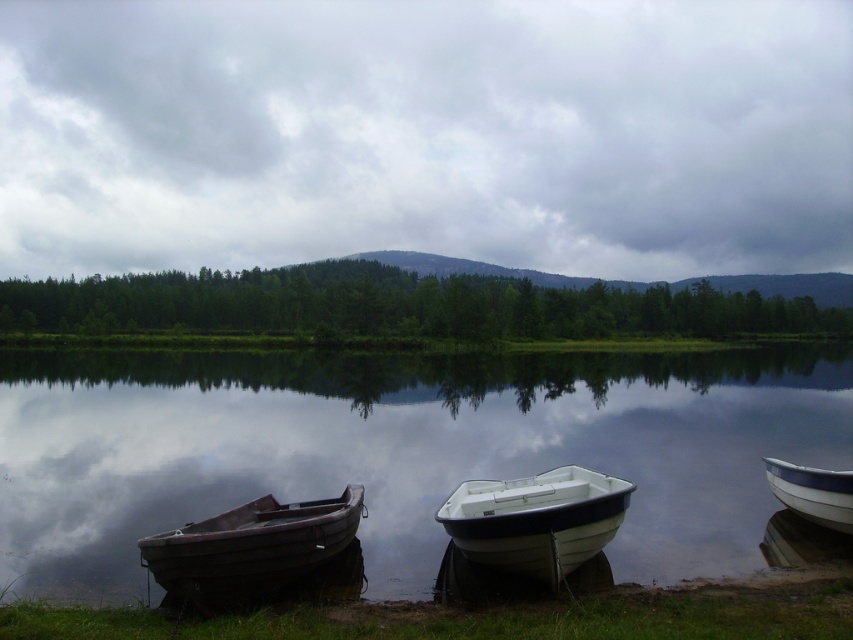
Based on the photo, is glossy reflective water at center thinner than green matte trees at center?

Yes.

Does point (662, 474) come farther from viewer compared to point (746, 307)?

No, it is in front of (746, 307).

You are a GUI agent. You are given a task and a screenshot of the screen. Output one action in this format:
    pyautogui.click(x=<x>, y=<y>)
    Task: Click on the glossy reflective water at center
    The width and height of the screenshot is (853, 640).
    Given the screenshot: What is the action you would take?
    399,449

Is dark brown wooden boat at lower left below white plastic boat at center?

Yes, dark brown wooden boat at lower left is below white plastic boat at center.

From the picture: Measure the distance between dark brown wooden boat at lower left and camera.

dark brown wooden boat at lower left is 7.24 meters away from camera.

Which is in front, point (297, 576) or point (492, 508)?

Point (297, 576)

Identify the location of dark brown wooden boat at lower left. (250, 548).

Is point (421, 305) farther from camera compared to point (456, 508)?

Yes, it is behind point (456, 508).

Does green matte trees at center have a lesser width compared to white plastic boat at center?

In fact, green matte trees at center might be wider than white plastic boat at center.

Does point (196, 310) come behind point (479, 490)?

Yes, it is.

Image resolution: width=853 pixels, height=640 pixels. Identify the location of green matte trees at center. click(x=399, y=305).